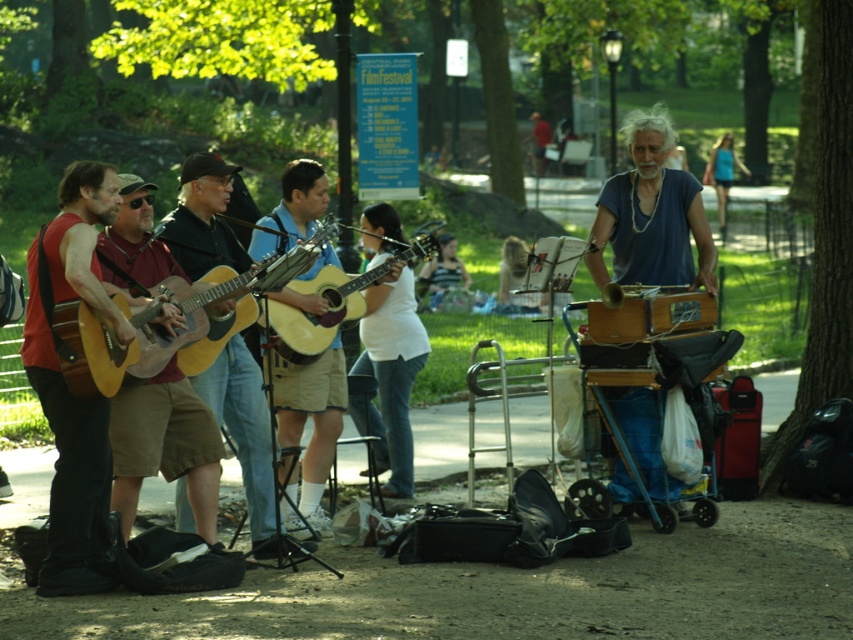
Question: Is matte brown guitar at left thinner than natural wood acoustic guitar at center?

Choices:
 (A) yes
 (B) no

Answer: (A)

Question: Based on their relative distances, which object is nearer to the red matte guitar at left?

Choices:
 (A) natural wood acoustic guitar at center
 (B) blue fabric shirt at right
 (C) wooden acoustic guitar at center
 (D) acoustic wood guitar at center

Answer: (A)

Question: From the image, what is the correct spatial relationship of blue fabric shirt at right in relation to acoustic wood guitar at center?

Choices:
 (A) above
 (B) below

Answer: (A)

Question: In this image, where is matte brown guitar at left located relative to acoustic wood guitar at center?

Choices:
 (A) above
 (B) below

Answer: (B)

Question: Which of the following is the farthest from the observer?

Choices:
 (A) acoustic wood guitar at center
 (B) natural wood acoustic guitar at center
 (C) blue fabric shirt at right

Answer: (C)

Question: Which point appears closest to the camera in this image?

Choices:
 (A) (103, 576)
 (B) (213, 163)
 (C) (219, 342)

Answer: (A)